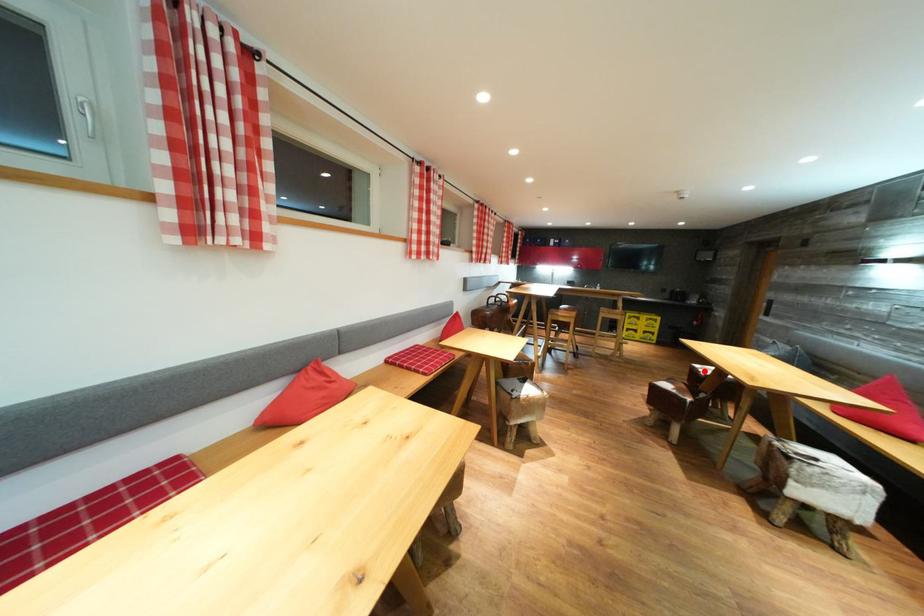
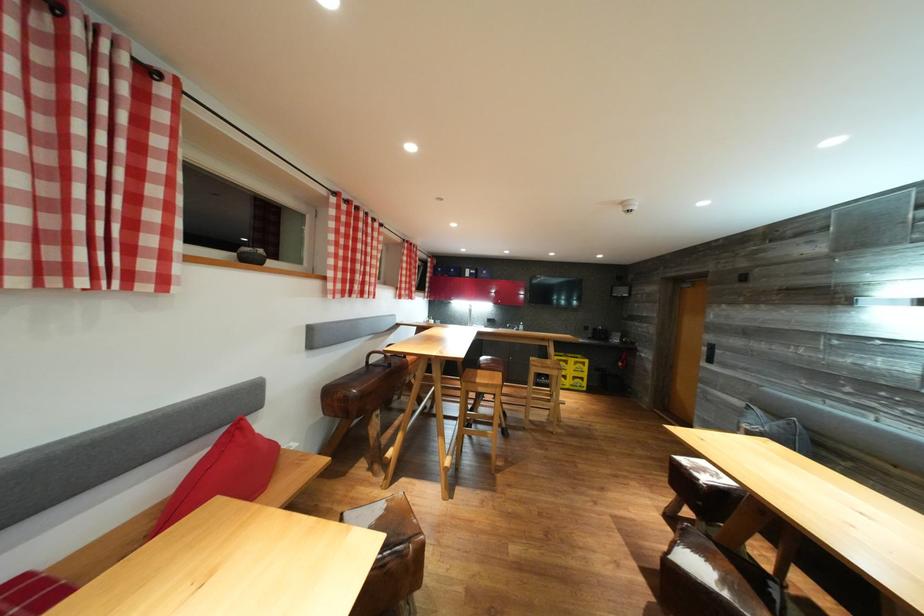
The point at the highlighted location is marked in the first image. Where is the corresponding point in the second image?

(689, 466)